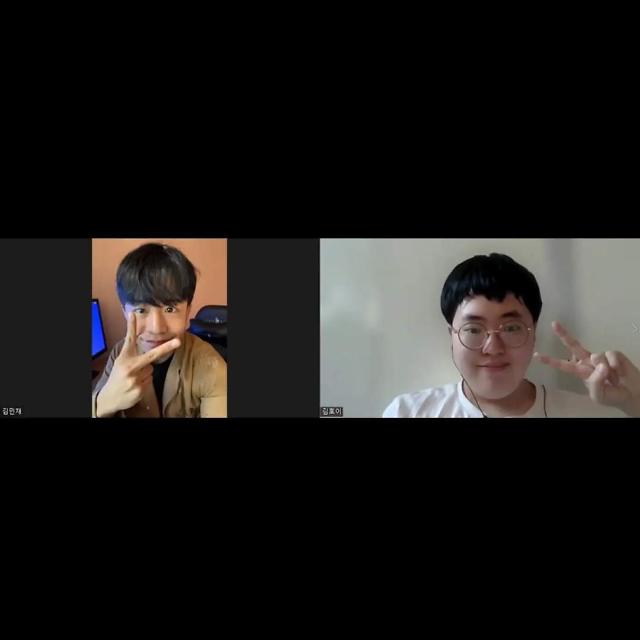
At what (x,y) coordinates should I click in order to perform the action: click on monitor. Please return your answer as a coordinate pair (x, y). Image resolution: width=640 pixels, height=640 pixels. Looking at the image, I should click on (97, 339).